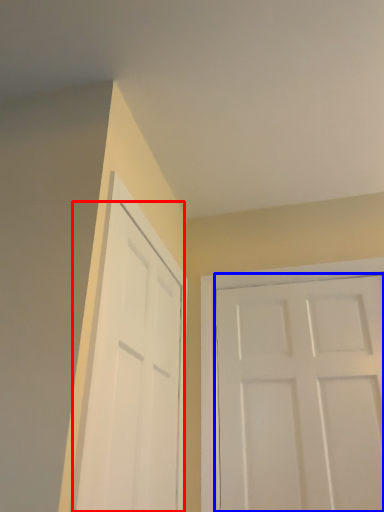
Question: Which point is further to the camera, door (highlighted by a red box) or door (highlighted by a blue box)?

Choices:
 (A) door
 (B) door

Answer: (B)